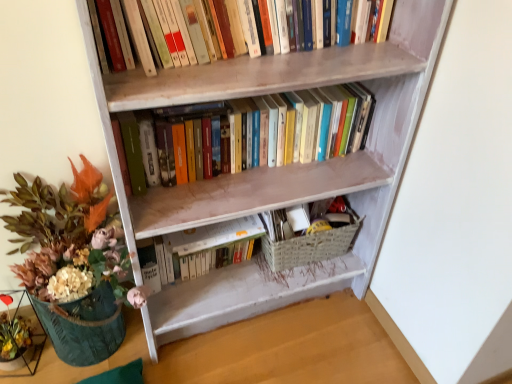
In order to click on hardcover books at center, the second book when ordered from top to bottom in this screenshot , I will do `click(265, 136)`.

What is the approximate height of woven beige basket at lower center?

The height of woven beige basket at lower center is 6.65 inches.

What do you see at coordinates (116, 37) in the screenshot?
I see `hardcover books at upper center, which ranks as the third book in bottom-to-top order` at bounding box center [116, 37].

Image resolution: width=512 pixels, height=384 pixels. Find the location of `hardcover books at center, which is the 2th book in bottom-to-top order`. hardcover books at center, which is the 2th book in bottom-to-top order is located at coordinates (265, 136).

Looking at this image, would you say green textured vase at lower left is to the left or to the right of woven beige basket at lower center in the picture?

Clearly, green textured vase at lower left is on the left of woven beige basket at lower center in the image.

What's the angular difference between green textured vase at lower left and woven beige basket at lower center's facing directions?

The angle between the facing direction of green textured vase at lower left and the facing direction of woven beige basket at lower center is 1.74 degrees.

Can you confirm if green textured vase at lower left is taller than woven beige basket at lower center?

Yes, green textured vase at lower left is taller than woven beige basket at lower center.

From a real-world perspective, between green textured vase at lower left and woven beige basket at lower center, who is vertically higher?

green textured vase at lower left is physically above.

Based on their positions, is green textured vase at lower left located to the left or right of white matte book at center, marked as the third book in a top-to-bottom arrangement?

Based on their positions, green textured vase at lower left is located to the left of white matte book at center, marked as the third book in a top-to-bottom arrangement.

Which object is thinner, green textured vase at lower left or white matte book at center, which appears as the 1th book when ordered from the bottom?

With smaller width is white matte book at center, which appears as the 1th book when ordered from the bottom.

Does green textured vase at lower left have a greater height compared to white matte book at center, marked as the third book in a top-to-bottom arrangement?

Indeed, green textured vase at lower left has a greater height compared to white matte book at center, marked as the third book in a top-to-bottom arrangement.

From a real-world perspective, who is located lower, green textured vase at lower left or white matte book at center, marked as the third book in a top-to-bottom arrangement?

white matte book at center, marked as the third book in a top-to-bottom arrangement.

Looking at this image, does hardcover books at upper center, which ranks as the third book in bottom-to-top order, appear on the right side of wooden bookcase at center?

No.

Considering the relative sizes of hardcover books at upper center, which ranks as the third book in bottom-to-top order, and wooden bookcase at center in the image provided, is hardcover books at upper center, which ranks as the third book in bottom-to-top order, smaller than wooden bookcase at center?

Correct, hardcover books at upper center, which ranks as the third book in bottom-to-top order, occupies less space than wooden bookcase at center.

Is hardcover books at upper center, which ranks as the third book in bottom-to-top order, in contact with wooden bookcase at center?

hardcover books at upper center, which ranks as the third book in bottom-to-top order, is not next to wooden bookcase at center, and they're not touching.

From a real-world perspective, between hardcover books at upper center, which ranks as the third book in bottom-to-top order, and wooden bookcase at center, who is vertically higher?

hardcover books at upper center, which ranks as the third book in bottom-to-top order, is physically above.

Considering the sizes of white matte book at center, marked as the third book in a top-to-bottom arrangement, and woven beige basket at lower center in the image, is white matte book at center, marked as the third book in a top-to-bottom arrangement, wider or thinner than woven beige basket at lower center?

Clearly, white matte book at center, marked as the third book in a top-to-bottom arrangement, has less width compared to woven beige basket at lower center.

Measure the distance from white matte book at center, marked as the third book in a top-to-bottom arrangement, to woven beige basket at lower center.

The distance of white matte book at center, marked as the third book in a top-to-bottom arrangement, from woven beige basket at lower center is 8.70 inches.

Could you tell me if white matte book at center, marked as the third book in a top-to-bottom arrangement, is turned towards woven beige basket at lower center?

No, white matte book at center, marked as the third book in a top-to-bottom arrangement, is not oriented towards woven beige basket at lower center.

From a real-world perspective, starting from the woven beige basket at lower center, which book is the 1st one vertically above it? Please provide its 2D coordinates.

[(207, 247)]

Is hardcover books at center, the second book when ordered from top to bottom, touching woven beige basket at lower center?

No, hardcover books at center, the second book when ordered from top to bottom, is not with woven beige basket at lower center.

Between hardcover books at center, the second book when ordered from top to bottom, and woven beige basket at lower center, which one has larger width?

With larger width is woven beige basket at lower center.

In the image, is hardcover books at center, which is the 2th book in bottom-to-top order, on the left side or the right side of woven beige basket at lower center?

hardcover books at center, which is the 2th book in bottom-to-top order, is positioned on woven beige basket at lower center's left side.

Based on their sizes in the image, would you say hardcover books at center, which is the 2th book in bottom-to-top order, is bigger or smaller than woven beige basket at lower center?

Considering their sizes, hardcover books at center, which is the 2th book in bottom-to-top order, takes up more space than woven beige basket at lower center.

Is green textured vase at lower left at the back of hardcover books at center, which is the 2th book in bottom-to-top order?

No.

Looking at the image, does hardcover books at center, which is the 2th book in bottom-to-top order, seem bigger or smaller compared to green textured vase at lower left?

Considering their sizes, hardcover books at center, which is the 2th book in bottom-to-top order, takes up less space than green textured vase at lower left.

From the image's perspective, who appears lower, hardcover books at center, the second book when ordered from top to bottom, or green textured vase at lower left?

green textured vase at lower left appears lower in the image.

Are hardcover books at center, which is the 2th book in bottom-to-top order, and green textured vase at lower left located far from each other?

That's not correct — hardcover books at center, which is the 2th book in bottom-to-top order, is a little close to green textured vase at lower left.

Could you tell me if hardcover books at center, which is the 2th book in bottom-to-top order, is facing hardcover books at upper center, which ranks as the third book in bottom-to-top order?

No.

Is point (318, 105) positioned behind point (132, 60)?

Yes.

From the image's perspective, which one is positioned lower, hardcover books at center, which is the 2th book in bottom-to-top order, or hardcover books at upper center, marked as the 1th book in a top-to-bottom arrangement?

hardcover books at center, which is the 2th book in bottom-to-top order, is shown below in the image.

Image resolution: width=512 pixels, height=384 pixels. In order to click on houseplant lying in front of the woven beige basket at lower center in this screenshot , I will do `click(74, 262)`.

From the image's perspective, which book is the 1st one above the green textured vase at lower left? Please provide its 2D coordinates.

[(207, 247)]

Which object lies further to the anchor point hardcover books at center, which is the 2th book in bottom-to-top order, green textured vase at lower left or woven beige basket at lower center?

Based on the image, green textured vase at lower left appears to be further to hardcover books at center, which is the 2th book in bottom-to-top order.

Looking at the image, which one is located closer to hardcover books at center, which is the 2th book in bottom-to-top order, wooden bookcase at center or green textured vase at lower left?

wooden bookcase at center.

Which object lies further to the anchor point wooden bookcase at center, hardcover books at center, the second book when ordered from top to bottom, or hardcover books at upper center, marked as the 1th book in a top-to-bottom arrangement?

hardcover books at upper center, marked as the 1th book in a top-to-bottom arrangement, is further to wooden bookcase at center.

Looking at the image, which one is located closer to hardcover books at center, which is the 2th book in bottom-to-top order, wooden bookcase at center or hardcover books at upper center, which ranks as the third book in bottom-to-top order?

wooden bookcase at center is closer to hardcover books at center, which is the 2th book in bottom-to-top order.

Looking at the image, which one is located further to white matte book at center, which appears as the 1th book when ordered from the bottom, hardcover books at upper center, which ranks as the third book in bottom-to-top order, or hardcover books at center, which is the 2th book in bottom-to-top order?

The object further to white matte book at center, which appears as the 1th book when ordered from the bottom, is hardcover books at upper center, which ranks as the third book in bottom-to-top order.

Which object lies further to the anchor point green textured vase at lower left, woven beige basket at lower center or hardcover books at upper center, marked as the 1th book in a top-to-bottom arrangement?

woven beige basket at lower center lies further to green textured vase at lower left than the other object.

Which object lies nearer to the anchor point woven beige basket at lower center, hardcover books at upper center, marked as the 1th book in a top-to-bottom arrangement, or white matte book at center, marked as the third book in a top-to-bottom arrangement?

white matte book at center, marked as the third book in a top-to-bottom arrangement, is closer to woven beige basket at lower center.

Looking at the image, which one is located further to green textured vase at lower left, hardcover books at center, which is the 2th book in bottom-to-top order, or white matte book at center, marked as the third book in a top-to-bottom arrangement?

hardcover books at center, which is the 2th book in bottom-to-top order.

In order to click on basket between hardcover books at center, the second book when ordered from top to bottom, and white matte book at center, marked as the third book in a top-to-bottom arrangement, vertically in this screenshot , I will do `click(309, 247)`.

At what (x,y) coordinates should I click in order to perform the action: click on basket that lies between hardcover books at upper center, marked as the 1th book in a top-to-bottom arrangement, and green textured vase at lower left from top to bottom. Please return your answer as a coordinate pair (x, y). Looking at the image, I should click on (309, 247).

Find the location of a particular element. book that lies between hardcover books at upper center, which ranks as the third book in bottom-to-top order, and wooden bookcase at center from top to bottom is located at coordinates (265, 136).

This screenshot has width=512, height=384. Identify the location of bookcase between green textured vase at lower left and woven beige basket at lower center. (273, 171).